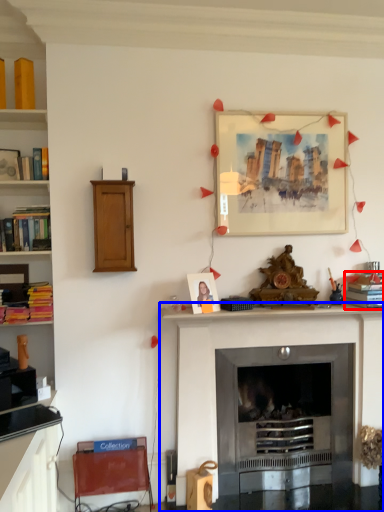
Question: Which object appears farthest to the camera in this image, book (highlighted by a red box) or fireplace (highlighted by a blue box)?

Choices:
 (A) book
 (B) fireplace

Answer: (A)